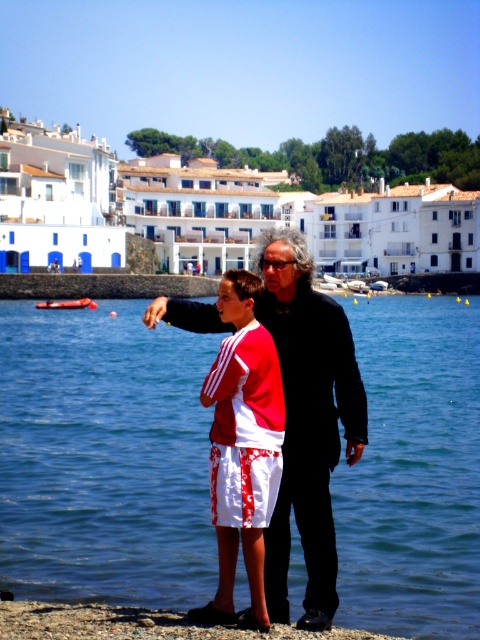
You are a photographer planning to take a portrait of the two people in the scene. You want to ensure that both the black matte jacket at center and the white cotton shorts at center are clearly visible in the frame. Based on their sizes, which object should you focus on to ensure both are in focus?

The black matte jacket at center is taller than the white cotton shorts at center, so focusing on the black matte jacket at center will ensure both are in focus as it is the larger object.

You are a photographer positioned at the shoreline. You need to capture a photo where the black matte jacket at center and white cotton shorts at center are both visible. Based on their positions, which one should be placed on the right side of the photo to ensure they are both in frame?

The black matte jacket at center should be placed on the right side of the photo since it is already positioned to the right of the white cotton shorts at center in the scene.